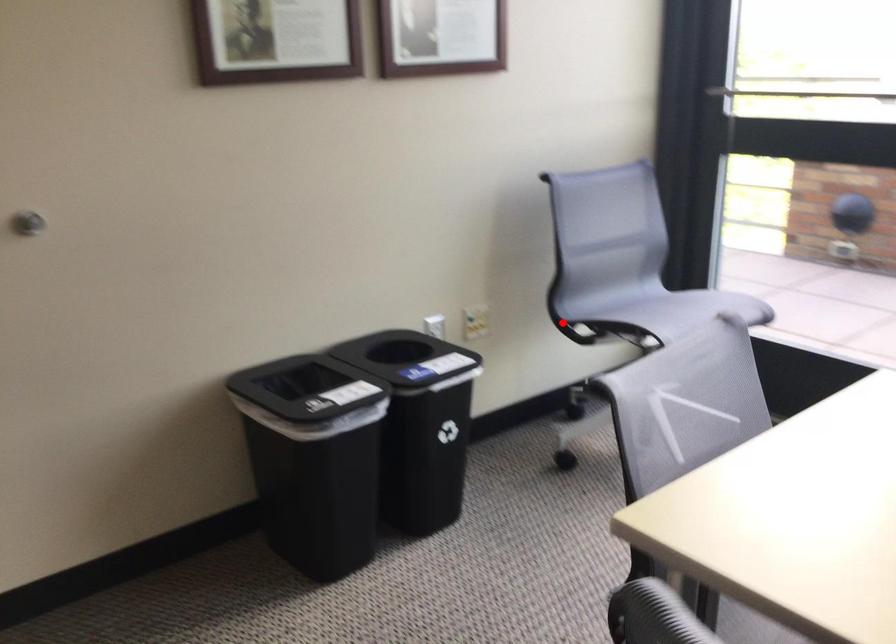
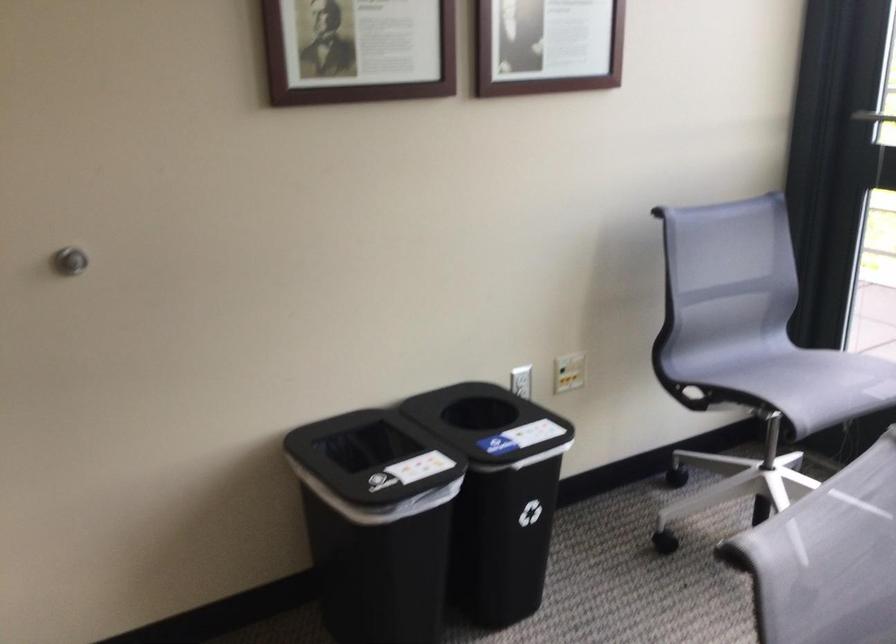
The point at the highlighted location is marked in the first image. Where is the corresponding point in the second image?

(668, 382)